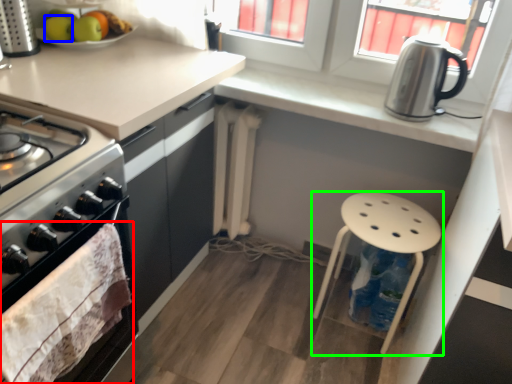
Question: Which object is positioned farthest from material (highlighted by a red box)? Select from apple (highlighted by a blue box) and stool (highlighted by a green box).

Choices:
 (A) apple
 (B) stool

Answer: (B)